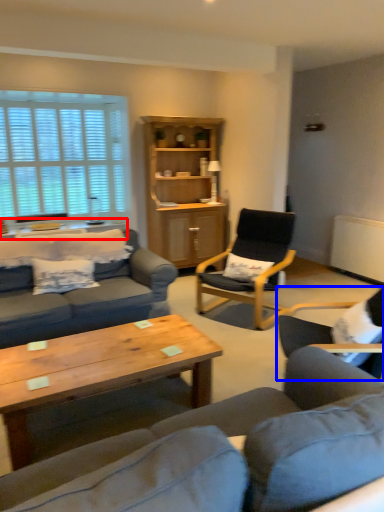
Question: Which object is closer to the camera taking this photo, table (highlighted by a red box) or chair (highlighted by a blue box)?

Choices:
 (A) table
 (B) chair

Answer: (B)